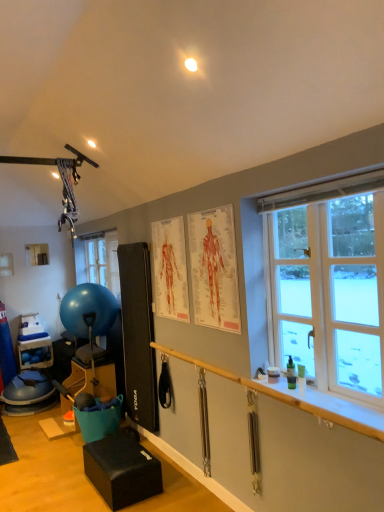
Question: Is wooden rail at lower right closer to the viewer compared to blue rubber ball at left?

Choices:
 (A) yes
 (B) no

Answer: (A)

Question: Is wooden rail at lower right facing towards blue rubber ball at left?

Choices:
 (A) yes
 (B) no

Answer: (B)

Question: Does wooden rail at lower right have a lesser width compared to blue rubber ball at left?

Choices:
 (A) yes
 (B) no

Answer: (A)

Question: Is wooden rail at lower right touching blue rubber ball at left?

Choices:
 (A) yes
 (B) no

Answer: (B)

Question: Could blue rubber ball at left be considered to be inside wooden rail at lower right?

Choices:
 (A) no
 (B) yes

Answer: (A)

Question: Is wooden rail at lower right looking in the opposite direction of blue rubber ball at left?

Choices:
 (A) no
 (B) yes

Answer: (A)

Question: Is matte black exercise ball at left, arranged as the 2th furniture when viewed from the front, positioned with its back to wooden rail at lower right?

Choices:
 (A) yes
 (B) no

Answer: (B)

Question: Is wooden rail at lower right completely or partially inside matte black exercise ball at left, arranged as the 2th furniture when viewed from the front?

Choices:
 (A) no
 (B) yes

Answer: (A)

Question: Can you confirm if matte black exercise ball at left, which is the first furniture in left-to-right order, is smaller than wooden rail at lower right?

Choices:
 (A) yes
 (B) no

Answer: (B)

Question: Is the surface of matte black exercise ball at left, arranged as the 2th furniture when viewed from the front, in direct contact with wooden rail at lower right?

Choices:
 (A) no
 (B) yes

Answer: (A)

Question: From a real-world perspective, does matte black exercise ball at left, arranged as the 2th furniture when viewed from the front, sit lower than wooden rail at lower right?

Choices:
 (A) no
 (B) yes

Answer: (B)

Question: Is matte black exercise ball at left, which is the 2th furniture from right to left, far away from wooden rail at lower right?

Choices:
 (A) yes
 (B) no

Answer: (A)

Question: From a real-world perspective, is black leather cushion at lower center, which is the first furniture in front-to-back order, positioned over white plastic window sill at lower right based on gravity?

Choices:
 (A) no
 (B) yes

Answer: (A)